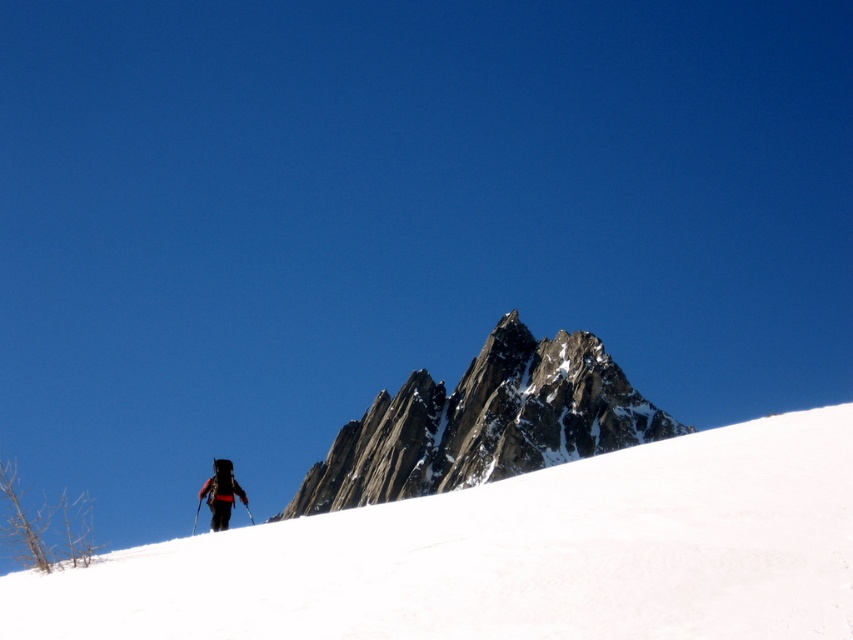
Is the position of white snow at center less distant than that of black fabric backpack at lower center?

Yes, it is.

Between white snow at center and black fabric backpack at lower center, which one is positioned higher?

Positioned higher is white snow at center.

Does point (708, 596) come in front of point (207, 490)?

Yes, point (708, 596) is closer to viewer.

The image size is (853, 640). In order to click on white snow at center in this screenshot , I will do `click(511, 554)`.

Is rocky gray mountain peak at center closer to the viewer compared to black fabric backpack at lower center?

No.

Can you confirm if rocky gray mountain peak at center is positioned to the left of black fabric backpack at lower center?

In fact, rocky gray mountain peak at center is to the right of black fabric backpack at lower center.

This screenshot has width=853, height=640. In order to click on rocky gray mountain peak at center in this screenshot , I will do `click(485, 422)`.

Image resolution: width=853 pixels, height=640 pixels. What are the coordinates of `rocky gray mountain peak at center` in the screenshot? It's located at (485, 422).

Who is lower down, white snow at center or rocky gray mountain peak at center?

Positioned lower is rocky gray mountain peak at center.

Does white snow at center have a smaller size compared to rocky gray mountain peak at center?

Yes, white snow at center is smaller than rocky gray mountain peak at center.

Where is `white snow at center`? The width and height of the screenshot is (853, 640). white snow at center is located at coordinates (511, 554).

Locate an element on the screen. This screenshot has height=640, width=853. white snow at center is located at coordinates (511, 554).